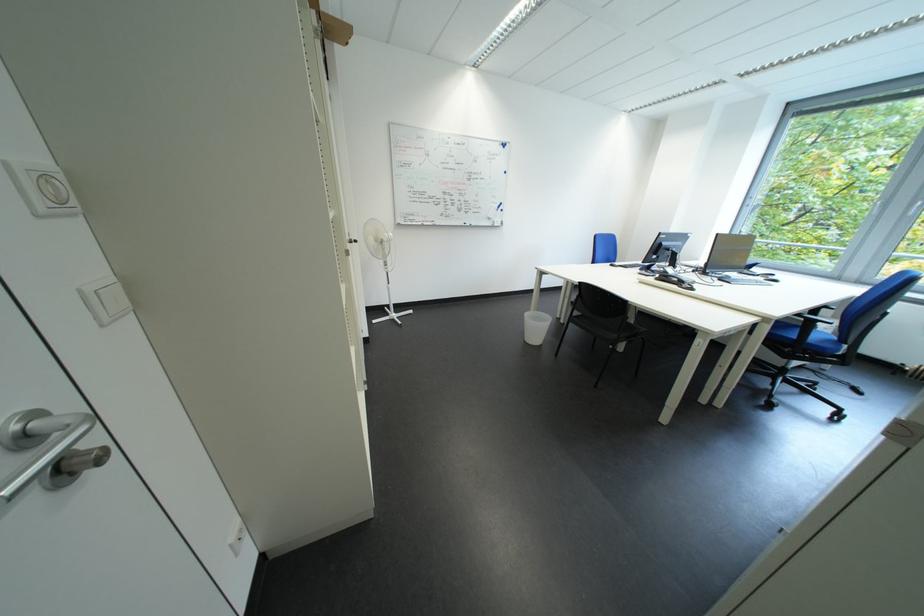
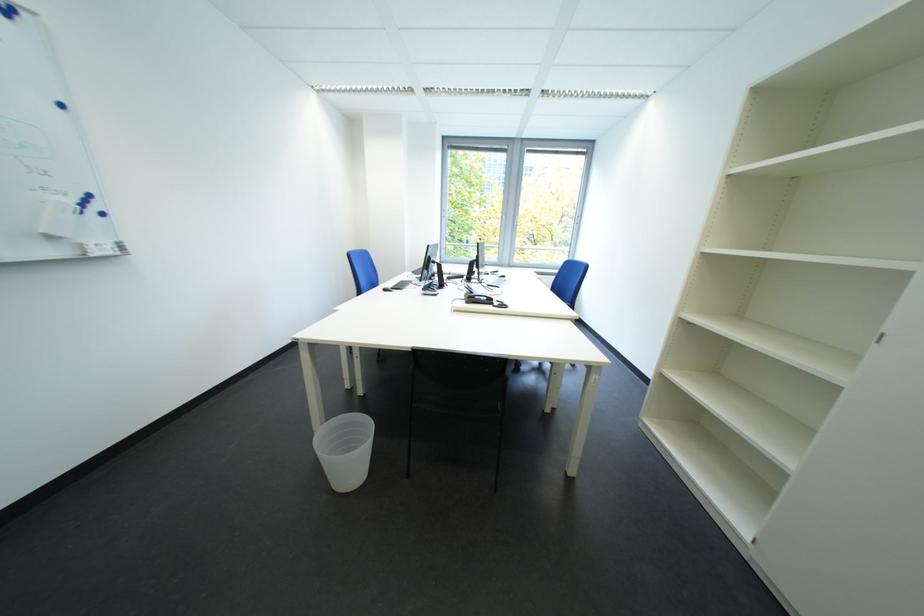
Find the pixel in the second image that matches pixel 517 148 in the first image.

(17, 12)